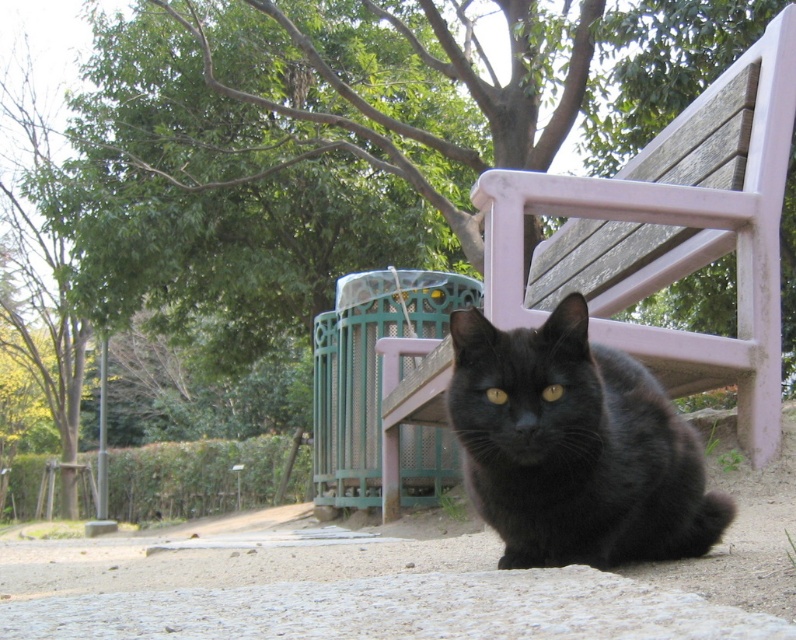
You are standing in the park and see the wooden park bench at center and the black fur cat at center. Which object is positioned to the right when facing the scene?

The wooden park bench at center is positioned to the right of the black fur cat at center.

You are a photographer trying to capture the black fur cat at center and the wooden park bench at center in the same frame. Based on their positions, which object is closer to the camera?

The wooden park bench at center is closer to the camera because the black fur cat at center is positioned behind it.

You are standing in the scene and want to place a small flag at the two points marked as point (393, 445) and point (553, 321). Which point is closer to you where you can place the flag without needing to move closer?

Point (393, 445) is closer to you than point (553, 321), so you can place the flag there without needing to move closer.